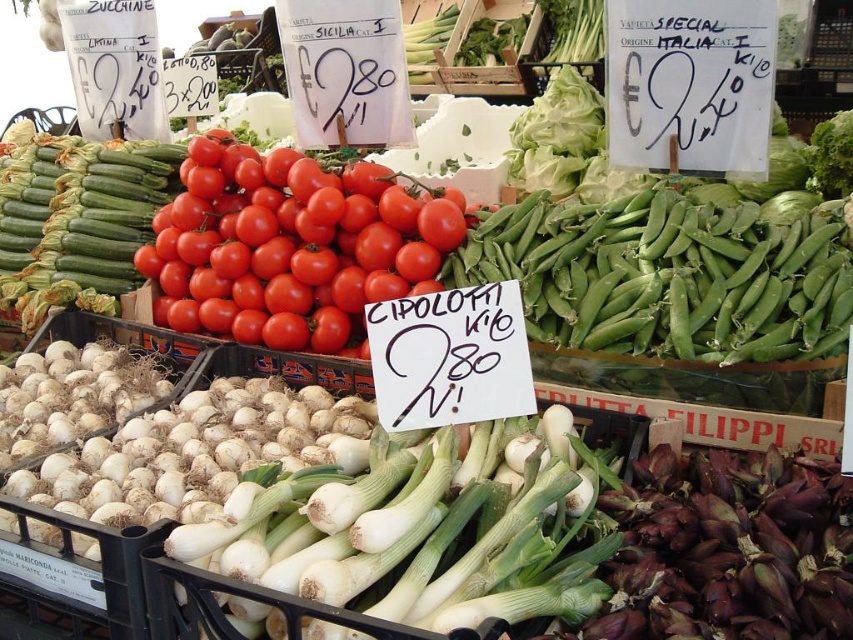
Question: Does shiny red tomatoes at center appear on the right side of green matte zucchini at upper left?

Choices:
 (A) yes
 (B) no

Answer: (A)

Question: Is green smooth peas at upper right to the right of shiny red tomatoes at center from the viewer's perspective?

Choices:
 (A) no
 (B) yes

Answer: (B)

Question: Considering the real-world distances, which object is farthest from the green smooth peas at upper right?

Choices:
 (A) green matte zucchini at upper left
 (B) shiny red tomatoes at center

Answer: (A)

Question: Among these objects, which one is farthest from the camera?

Choices:
 (A) green matte zucchini at upper left
 (B) shiny red tomatoes at center

Answer: (A)

Question: Can you confirm if green smooth peas at upper right is positioned to the left of green matte zucchini at upper left?

Choices:
 (A) yes
 (B) no

Answer: (B)

Question: Which point is farther to the camera?

Choices:
 (A) shiny red tomatoes at center
 (B) green matte zucchini at upper left

Answer: (B)